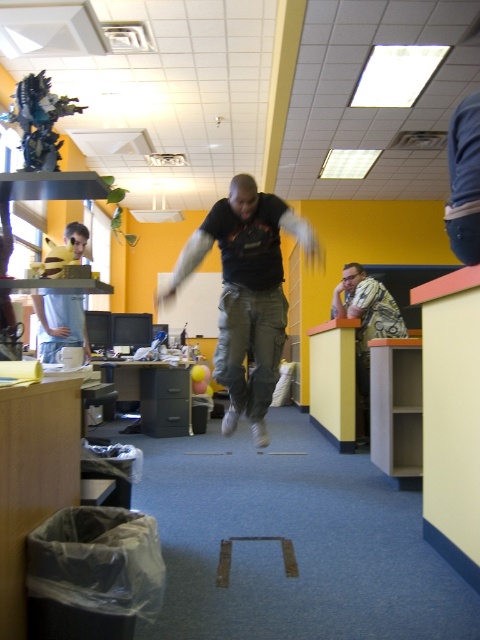
Does blue denim jeans at upper right have a greater height compared to printed fabric shirt at right?

No, blue denim jeans at upper right is not taller than printed fabric shirt at right.

Who is more distant from viewer, (468, 182) or (332, 316)?

The point (332, 316) is more distant.

Describe the element at coordinates (464, 180) in the screenshot. I see `blue denim jeans at upper right` at that location.

Find the location of `blue denim jeans at upper right`. blue denim jeans at upper right is located at coordinates (464, 180).

Does point (399, 321) come in front of point (64, 321)?

No, (399, 321) is further to viewer.

Is printed fabric shirt at right positioned behind matte black shirt at upper left?

Yes, printed fabric shirt at right is further from the viewer.

Is point (364, 406) behind point (80, 225)?

Yes, it is.

Where is `printed fabric shirt at right`? printed fabric shirt at right is located at coordinates (365, 321).

Between blue denim jeans at upper right and matte black shirt at upper left, which one appears on the left side from the viewer's perspective?

matte black shirt at upper left is more to the left.

In the scene shown: Is blue denim jeans at upper right thinner than matte black shirt at upper left?

Indeed, blue denim jeans at upper right has a lesser width compared to matte black shirt at upper left.

Between point (446, 230) and point (56, 344), which one is positioned behind?

Positioned behind is point (56, 344).

The width and height of the screenshot is (480, 640). Identify the location of blue denim jeans at upper right. (464, 180).